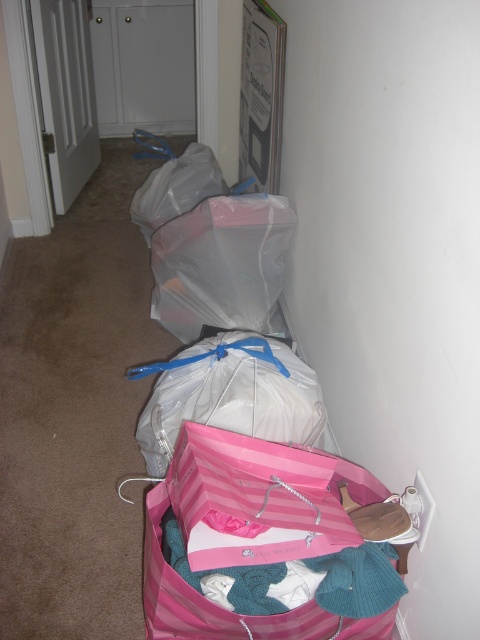
You are moving boxes down a hallway and see a clear plastic bag at center and a transparent plastic bag at center. Which one is lower?

The clear plastic bag at center is positioned under the transparent plastic bag at center, so it is lower.

You are moving into a new apartment and need to carry these bags through the hallway. The hallway is only 1 meter wide. Can both the pink striped paper bag at lower center and the transparent plastic bag at center fit side by side in the hallway?

The pink striped paper bag at lower center is smaller than the transparent plastic bag at center, but since the hallway is only 1 meter wide, we need to know their combined width to determine if they can fit. However, the description does not provide specific measurements for either bag. Therefore, it is impossible to confirm if they can fit side by side based on the given information.